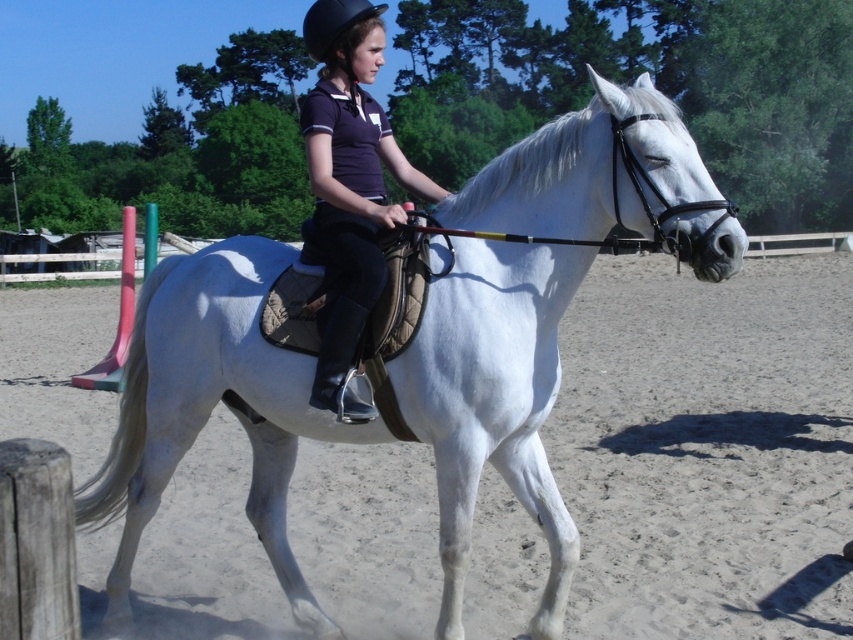
You are an equestrian instructor observing a rider in an arena. You notice a point marked at coordinates (212, 406). What object is located at this point?

The point at (212, 406) indicates the white matte or suede saddle at center.

You are a photographer standing in the arena, and you want to take a photo of the rider and the horse. The two helmets mentioned are both visible in the frame. How far apart are the matte black helmet at upper center and the black matte helmet at upper center in the image?

The matte black helmet at upper center and the black matte helmet at upper center are 4.51 feet apart from each other.